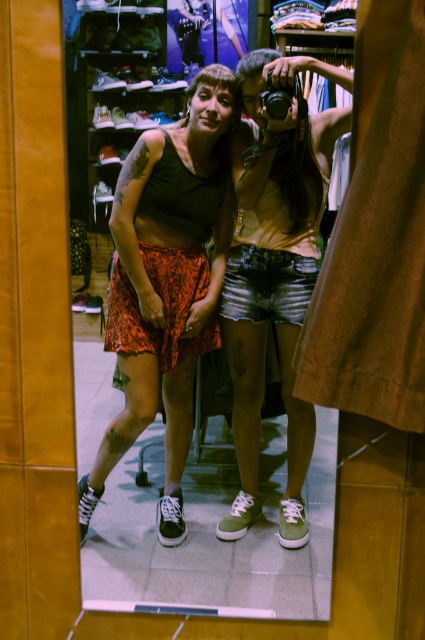
Who is more distant from viewer, (153, 417) or (241, 449)?

Point (241, 449)

You are a GUI agent. You are given a task and a screenshot of the screen. Output one action in this format:
    pyautogui.click(x=<x>, y=<y>)
    Task: Click on the matte black tank top at center
    The width and height of the screenshot is (425, 640).
    Given the screenshot: What is the action you would take?
    pyautogui.click(x=167, y=282)

Where is `matte black tank top at center`? matte black tank top at center is located at coordinates pyautogui.click(x=167, y=282).

Does denim shorts at center appear on the left side of black plastic camera at upper center?

No, denim shorts at center is not to the left of black plastic camera at upper center.

The height and width of the screenshot is (640, 425). What do you see at coordinates (274, 275) in the screenshot?
I see `denim shorts at center` at bounding box center [274, 275].

Locate an element on the screen. Image resolution: width=425 pixels, height=640 pixels. denim shorts at center is located at coordinates (274, 275).

Is point (192, 326) positioned after point (278, 109)?

Yes, point (192, 326) is farther from viewer.

Consider the image. Measure the distance between matte black tank top at center and black plastic camera at upper center.

matte black tank top at center is 24.11 inches away from black plastic camera at upper center.

Who is more forward, (224, 211) or (272, 104)?

Point (272, 104) is more forward.

I want to click on matte black tank top at center, so click(167, 282).